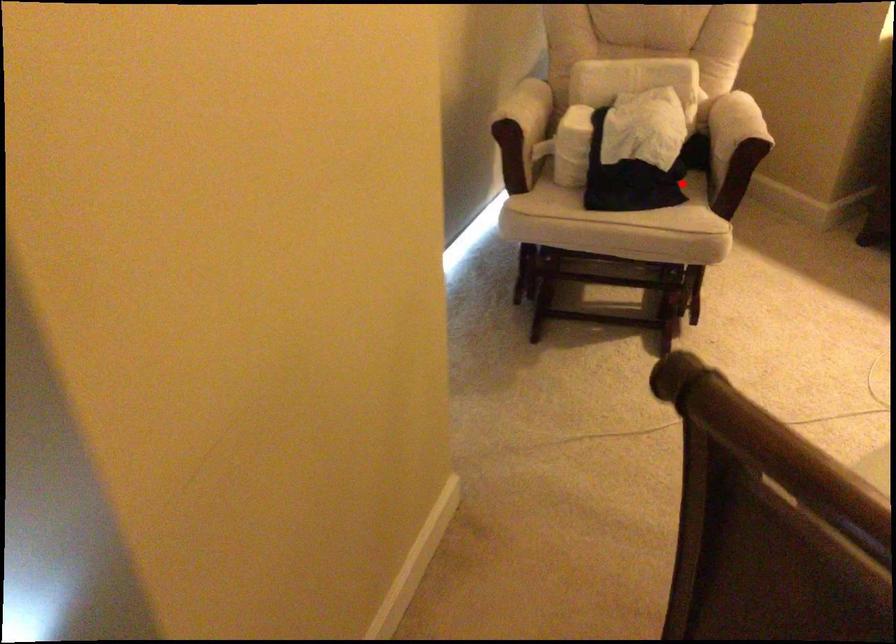
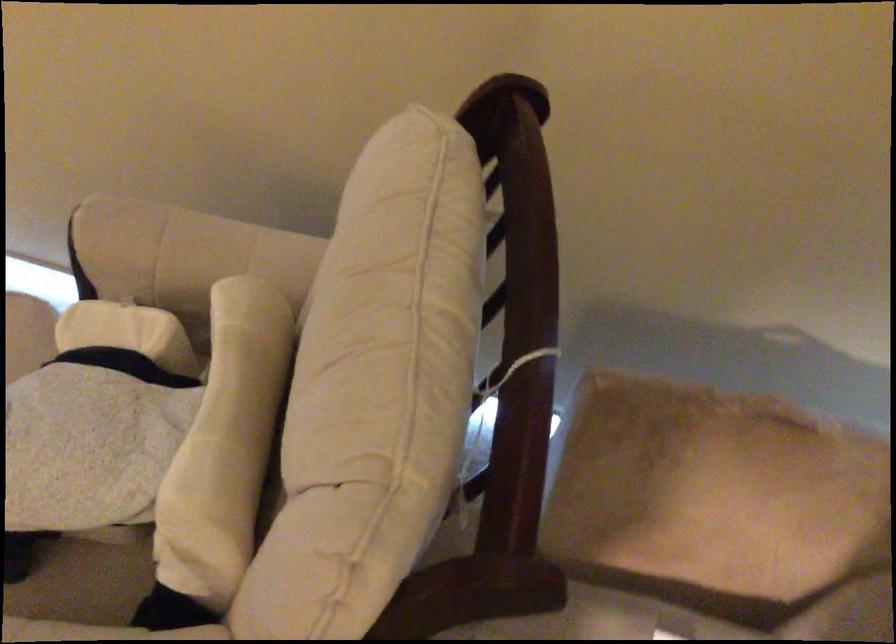
Question: I am providing you with two images of the same scene from different viewpoints. A red point is shown in image1. For the corresponding object point in image2, is it positioned nearer or farther from the camera?

Choices:
 (A) Nearer
 (B) Farther

Answer: (A)